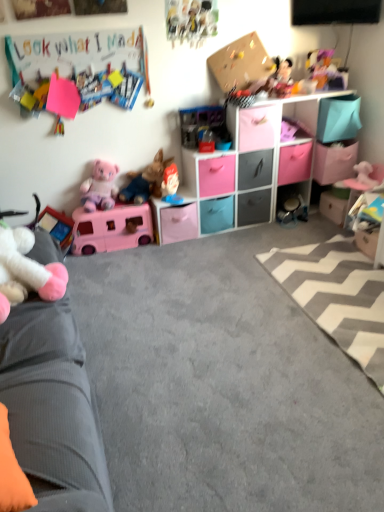
Find the location of `vacant region in front of blue matte drawer at center, arranged as the fifth drawer when viewed from the right`. vacant region in front of blue matte drawer at center, arranged as the fifth drawer when viewed from the right is located at coordinates (217, 246).